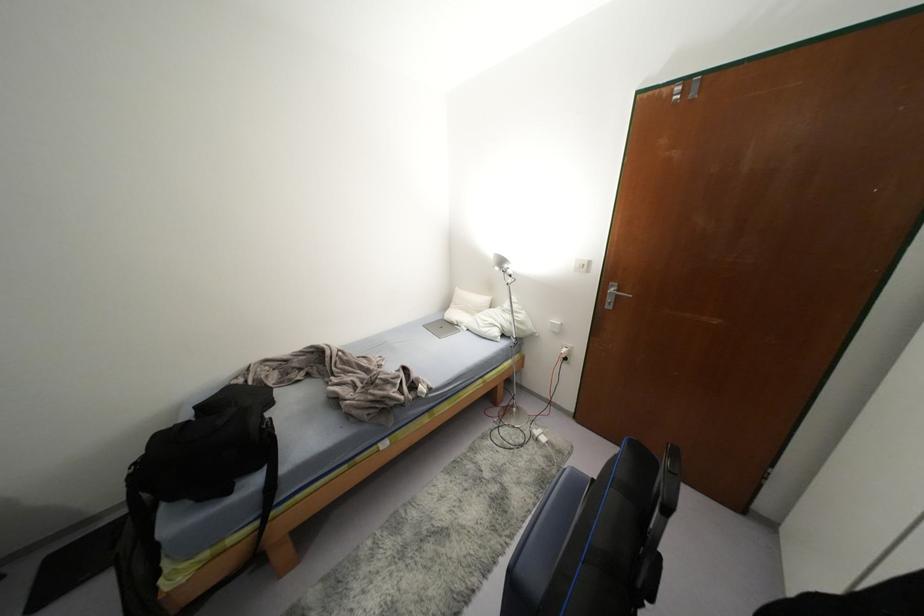
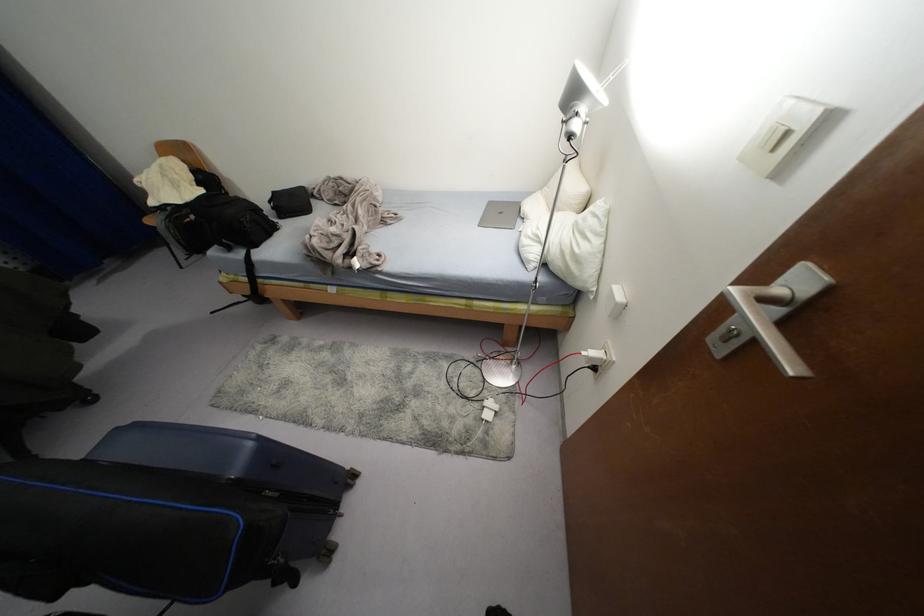
The point at (542, 438) is marked in the first image. Where is the corresponding point in the second image?

(487, 416)